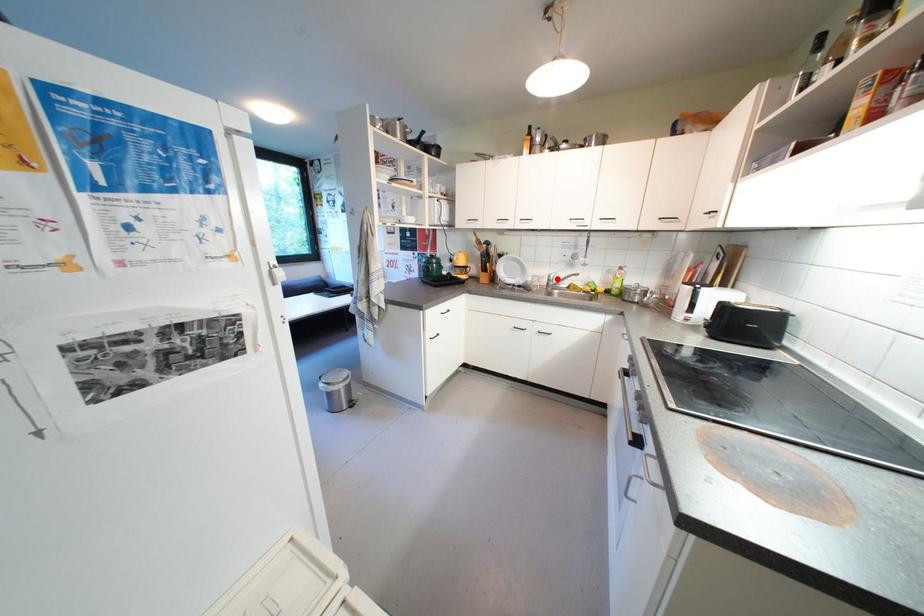
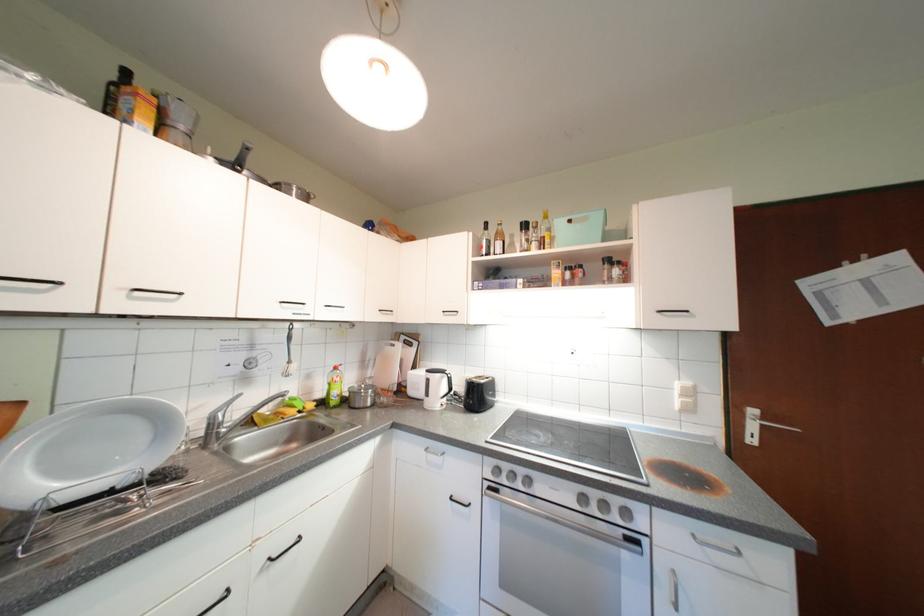
Locate, in the second image, the point that corresponds to the highlighted location in the first image.

(220, 419)